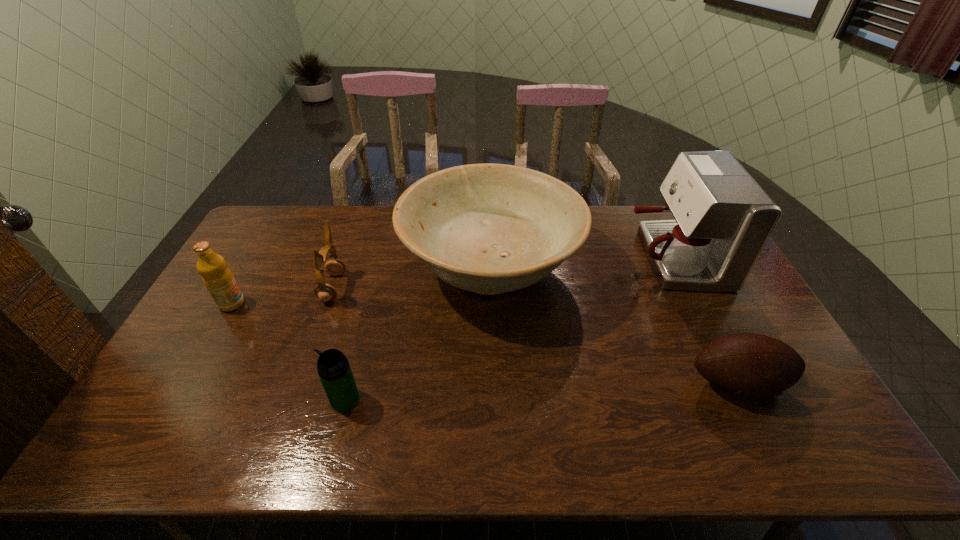
Where is `football that is at the right edge`? The height and width of the screenshot is (540, 960). football that is at the right edge is located at coordinates (754, 365).

Locate an element on the screen. Image resolution: width=960 pixels, height=540 pixels. object located in the far right corner section of the desktop is located at coordinates (723, 219).

This screenshot has height=540, width=960. In the image, there is a desktop. What are the coordinates of `vacant space at the far edge` in the screenshot? It's located at (324, 229).

This screenshot has width=960, height=540. In order to click on vacant area at the near edge in this screenshot , I will do `click(540, 435)`.

In the image, there is a desktop. Identify the location of vacant space at the left edge. (182, 372).

This screenshot has width=960, height=540. I want to click on free space at the far left corner, so click(x=277, y=222).

In the image, there is a desktop. In order to click on vacant region at the near left corner in this screenshot , I will do 151,432.

Identify the location of vacant space at the near right corner. (784, 442).

This screenshot has height=540, width=960. I want to click on vacant area that lies between the fourth object from left to right and the coffee maker, so click(x=582, y=263).

In order to click on unoccupied position between the tallest object and the shortest object in this screenshot , I will do `click(706, 320)`.